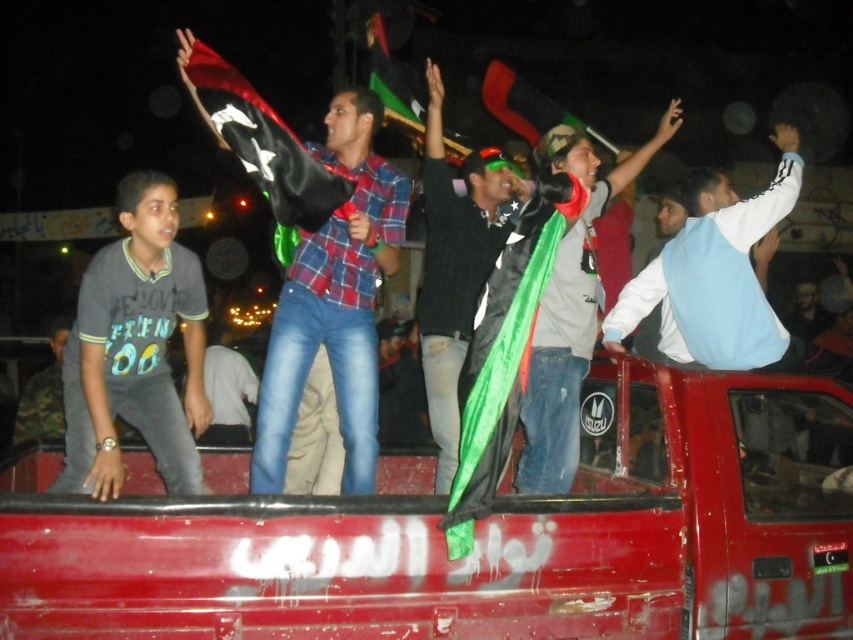
You are a photographer trying to capture a clear shot of the gray cotton shirt at left and the green fabric flag at center. Which object should you zoom in on to ensure it fills more of the frame without moving closer?

The gray cotton shirt at left is bigger than the green fabric flag at center, so you should zoom in on the gray cotton shirt at left to ensure it fills more of the frame without moving closer.

You are standing in front of the red pickup truck bed where the celebration is happening. You notice the plaid shirt at center and the green fabric flag at center. Which one is positioned to the left from your viewpoint?

The plaid shirt at center is to the left of the green fabric flag at center from your viewpoint.